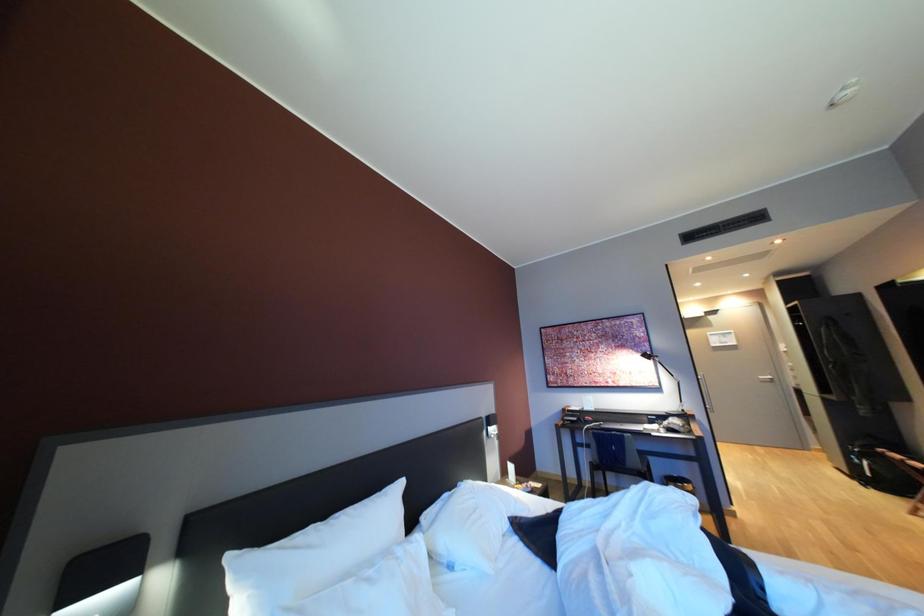
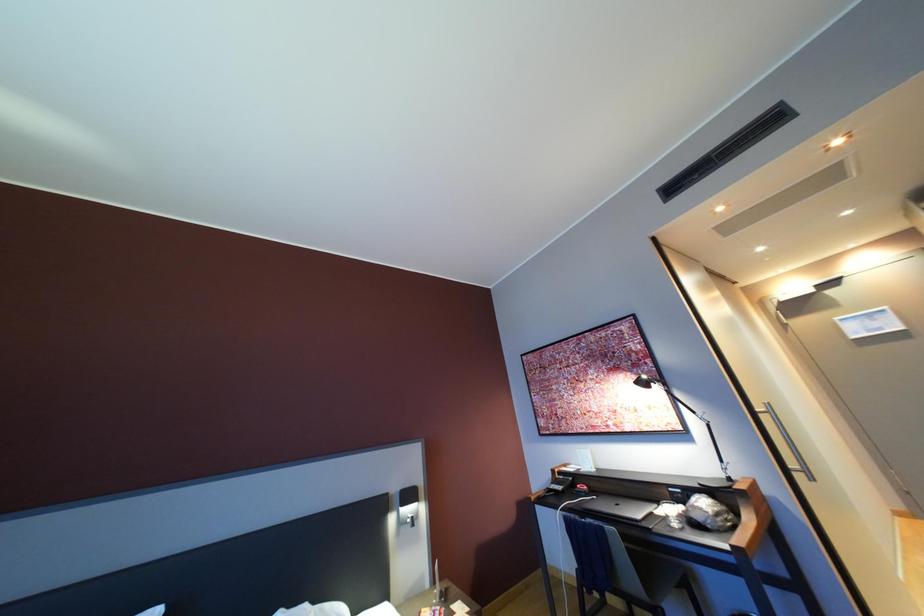
The images are taken continuously from a first-person perspective. In which direction are you moving?

The cameraman walked toward right, forward.